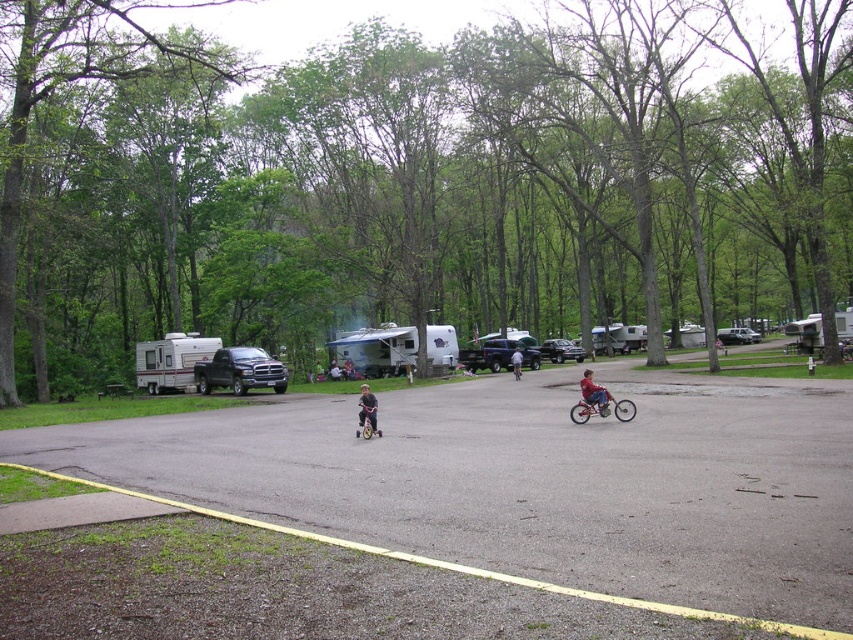
You are standing at the edge of the paved area and want to walk to the white textured camper at center. Which direction should you head relative to the silver metallic camper at left?

The white textured camper at center is to the right of the silver metallic camper at left, so you should head towards the right side of the silver metallic camper at left to reach the white textured camper at center.

You are planning to park your new white textured camper at center in the camping area. The light blue denim shorts at center is already parked there. Since both vehicles are at the center, which one is wider?

The white textured camper at center is wider than the light blue denim shorts at center because the white textured camper at center surpasses the light blue denim shorts at center in width.

You are planning to park your new white textured camper at center in a camping area. The parking spot you want is at coordinate point 0.547, 0.442. Do you think the camper will fit perfectly in that spot?

The white textured camper at center is already positioned at point (376, 349), so it fits perfectly in that spot.